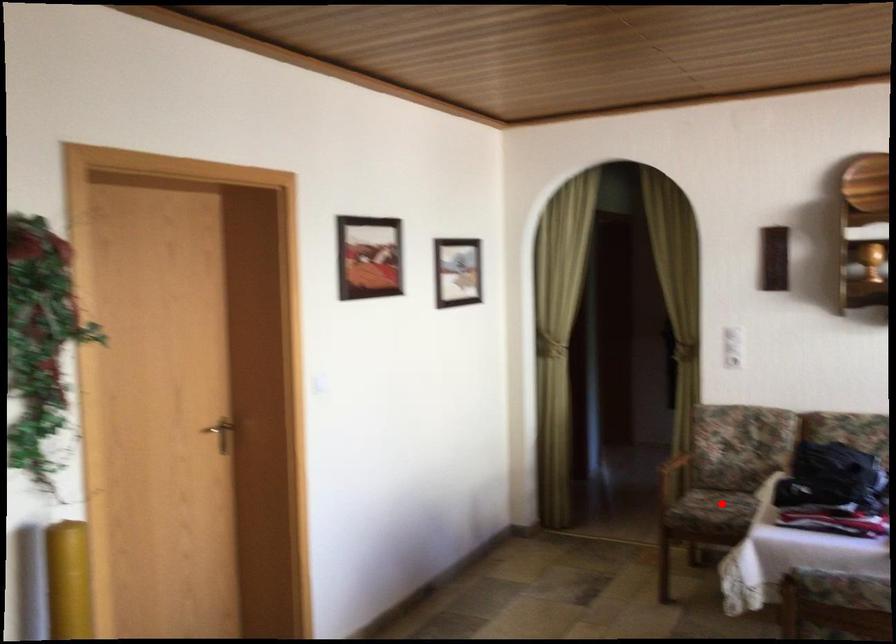
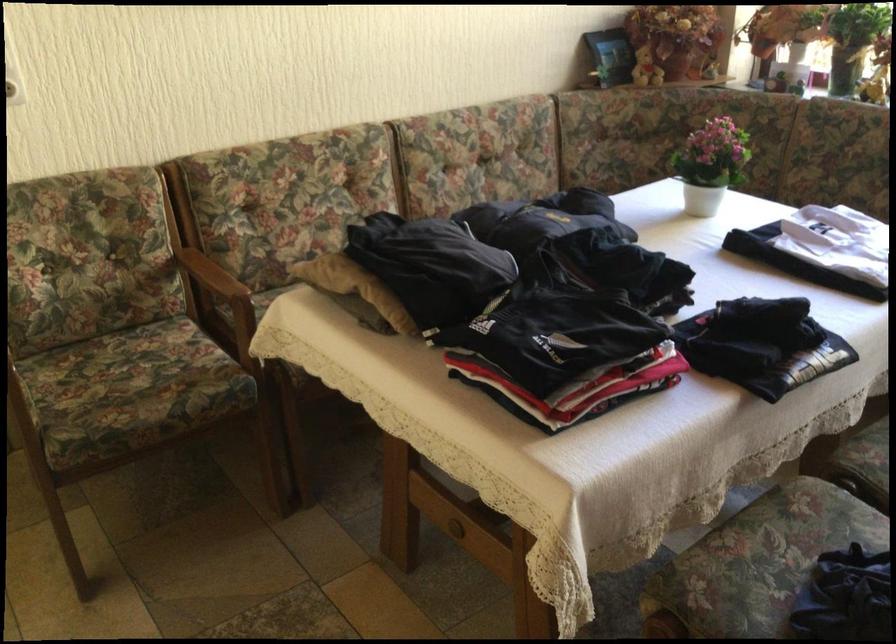
Question: I am providing you with two images of the same scene from different viewpoints. Image1 has a red point marked. In image2, the corresponding 3D location appears at what relative position? Reply with the corresponding letter.

Choices:
 (A) Closer
 (B) Farther

Answer: (A)